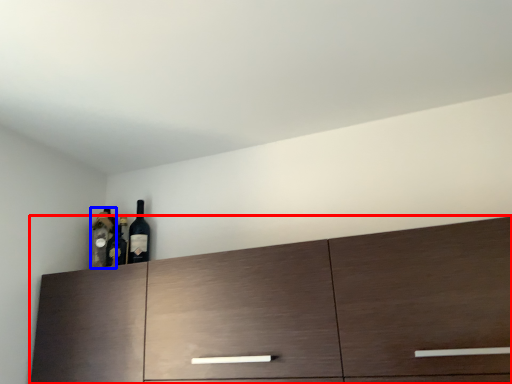
Question: Among these objects, which one is nearest to the camera, cabinetry (highlighted by a red box) or bottle (highlighted by a blue box)?

Choices:
 (A) cabinetry
 (B) bottle

Answer: (A)